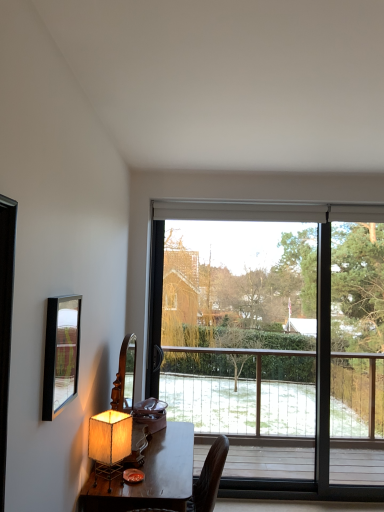
Question: Considering the positions of wooden desk at lower left and matte beige lampshade at lower left in the image, is wooden desk at lower left bigger or smaller than matte beige lampshade at lower left?

Choices:
 (A) small
 (B) big

Answer: (B)

Question: Relative to matte beige lampshade at lower left, is wooden desk at lower left in front or behind?

Choices:
 (A) behind
 (B) front

Answer: (B)

Question: Which object is the closest to the transparent glass window at center?

Choices:
 (A) wooden desk at lower left
 (B) matte black mirror at left
 (C) matte beige lampshade at lower left

Answer: (A)

Question: Which object is the farthest from the wooden desk at lower left?

Choices:
 (A) transparent glass window at center
 (B) matte beige lampshade at lower left
 (C) matte black mirror at left

Answer: (A)